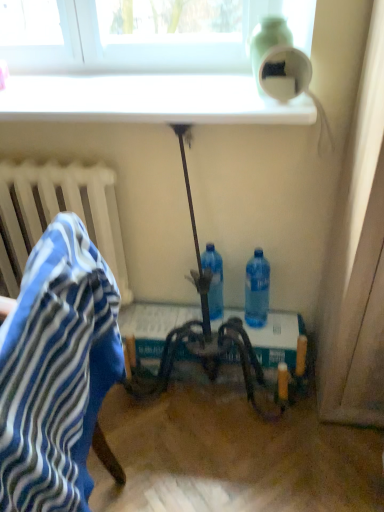
Question: From the image's perspective, would you say blue striped fabric at left is shown under green matte bottle at upper right, which is counted as the 1th bottle, starting from the top?

Choices:
 (A) no
 (B) yes

Answer: (B)

Question: From a real-world perspective, is blue striped fabric at left under green matte bottle at upper right, placed as the third bottle when sorted from bottom to top?

Choices:
 (A) no
 (B) yes

Answer: (B)

Question: Considering the relative sizes of blue striped fabric at left and green matte bottle at upper right, which is counted as the 1th bottle, starting from the top, in the image provided, is blue striped fabric at left thinner than green matte bottle at upper right, which is counted as the 1th bottle, starting from the top,?

Choices:
 (A) no
 (B) yes

Answer: (A)

Question: Is blue striped fabric at left far from green matte bottle at upper right, which is counted as the 1th bottle, starting from the top?

Choices:
 (A) yes
 (B) no

Answer: (B)

Question: Could green matte bottle at upper right, which is counted as the 1th bottle, starting from the top, be considered to be inside blue striped fabric at left?

Choices:
 (A) yes
 (B) no

Answer: (B)

Question: Is blue striped fabric at left oriented away from green matte bottle at upper right, placed as the third bottle when sorted from bottom to top?

Choices:
 (A) yes
 (B) no

Answer: (B)

Question: Does blue striped fabric at left come behind metallic silver table at center?

Choices:
 (A) yes
 (B) no

Answer: (B)

Question: Can metallic silver table at center be found inside blue striped fabric at left?

Choices:
 (A) yes
 (B) no

Answer: (B)

Question: Can you confirm if blue striped fabric at left is smaller than metallic silver table at center?

Choices:
 (A) no
 (B) yes

Answer: (B)

Question: Does blue striped fabric at left have a greater height compared to metallic silver table at center?

Choices:
 (A) yes
 (B) no

Answer: (B)

Question: From a real-world perspective, is blue striped fabric at left beneath metallic silver table at center?

Choices:
 (A) yes
 (B) no

Answer: (B)

Question: From a real-world perspective, does blue striped fabric at left stand above metallic silver table at center?

Choices:
 (A) no
 (B) yes

Answer: (B)

Question: Can you confirm if white glossy window sill at upper center is positioned to the right of green matte bottle at upper right, which is counted as the 1th bottle, starting from the top?

Choices:
 (A) no
 (B) yes

Answer: (A)